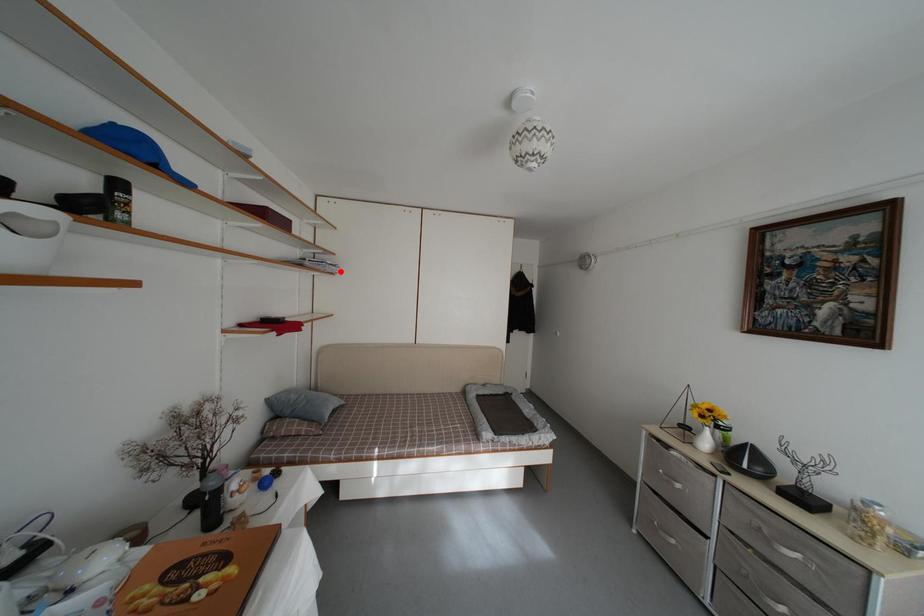
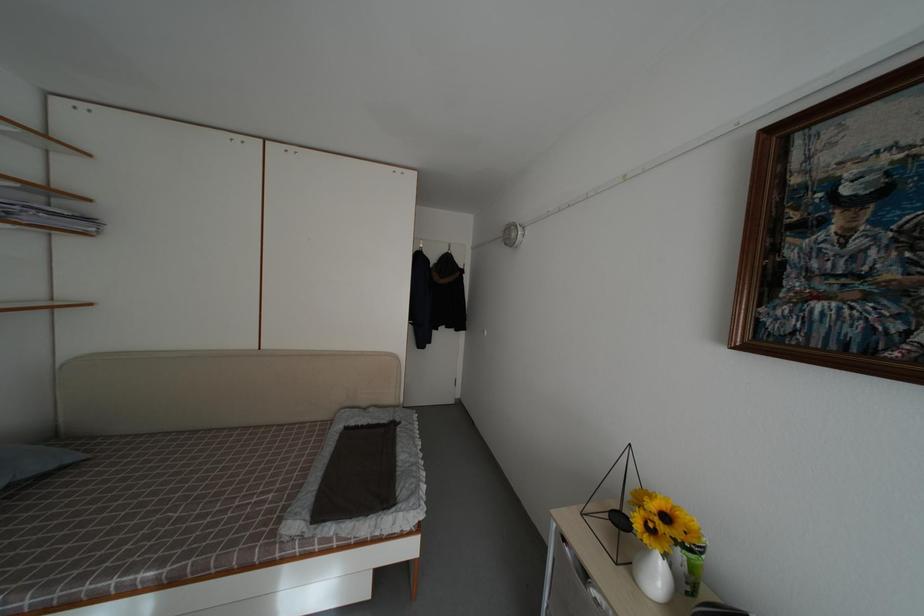
Find the pixel in the second image that matches the highlighted location in the first image.

(94, 225)